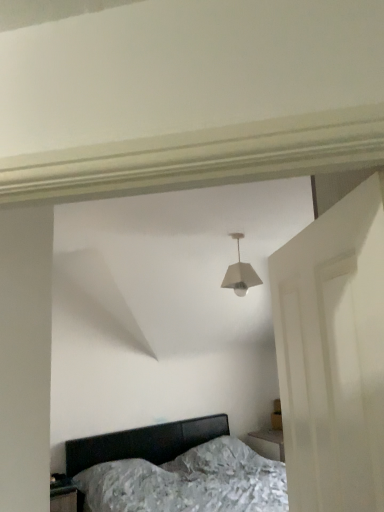
Identify the location of blank space situated above white matte lampshade at center (from a real-world perspective). This screenshot has height=512, width=384. (228, 231).